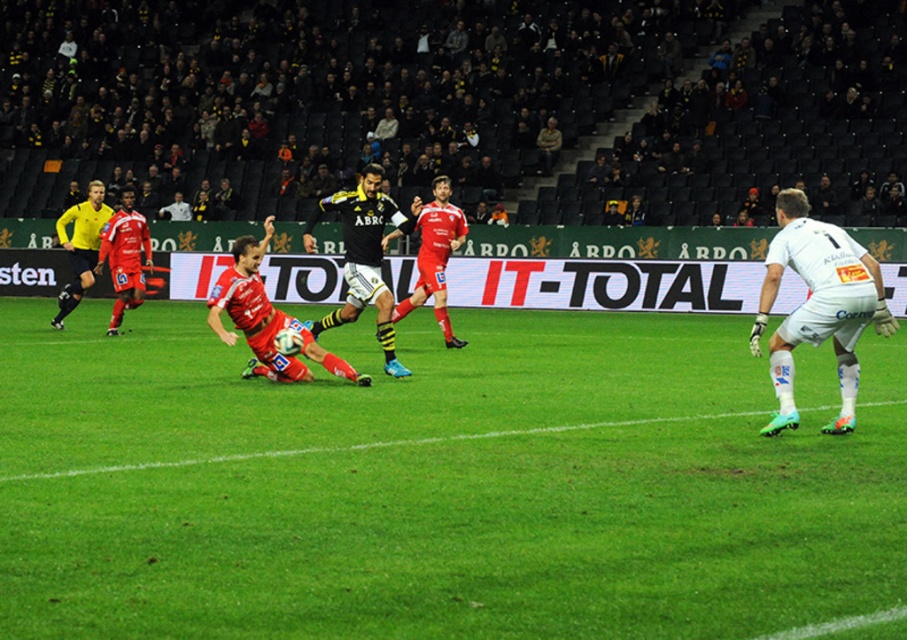
Consider the image. You are a soccer fan standing at the edge of the field. You see the matte red jersey at center and want to throw a water bottle to the player wearing it. The bottle can travel 50 feet. Will it reach the player?

The distance between the matte red jersey at center and the viewer is 55.39 feet, which is farther than the 50 feet the water bottle can travel. Therefore, the bottle will not reach the player.

You are a soccer player positioned at point (37, 586) on the field. You need to kick the ball to your teammate standing 10 meters away from the camera. Can you reach your teammate with a single kick?

The distance between point (37, 586) and the camera is 5.88 meters. Since your teammate is 10 meters away from the camera, the total distance between you and your teammate would be approximately 15.88 meters. A soccer kick can typically travel up to 30 meters, so yes, you can reach your teammate with a single kick.